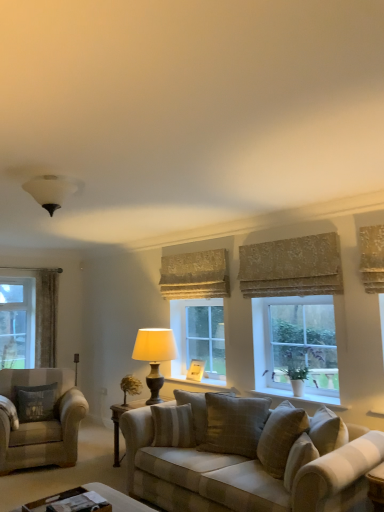
Question: From their relative heights in the image, would you say white matte lampshade at upper center, which is the 1th lamp from top to bottom, is taller or shorter than velvet curtain at left, which is the first curtain from left to right?

Choices:
 (A) tall
 (B) short

Answer: (B)

Question: Is white matte lampshade at upper center, which ranks as the second lamp in bottom-to-top order, bigger or smaller than velvet curtain at left, which is the first curtain from left to right?

Choices:
 (A) small
 (B) big

Answer: (A)

Question: Based on their relative distances, which object is nearer to the textured beige curtain at upper center, the third curtain from the back?

Choices:
 (A) plaid fabric couch at center
 (B) matte beige lamp at window, positioned as the 2th lamp in top-to-bottom order
 (C) wooden picture frame at center
 (D) textured beige curtain at center, marked as the second curtain in a back-to-front arrangement
 (E) beige textured pillow at center, which ranks as the 2th pillow in back-to-front order

Answer: (D)

Question: Which object is the closest to the green leafy plant at center?

Choices:
 (A) clear glass window at center, the 1th window positioned from the front
 (B) dark gray fabric pillow at left, which appears as the third pillow when viewed from the right
 (C) matte beige lamp at window, the second lamp viewed from the front
 (D) beige fabric armchair at left
 (E) wooden coffee table at lower center

Answer: (C)